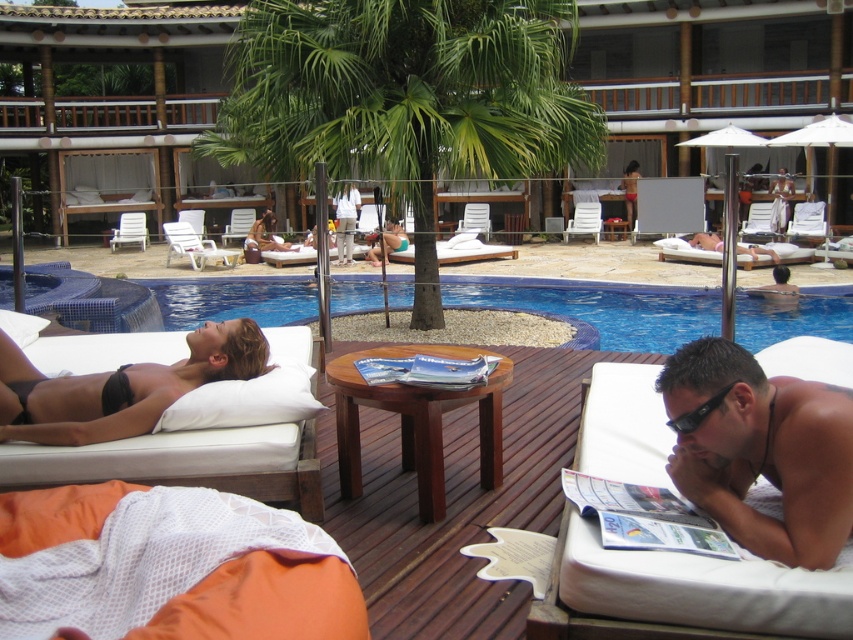
Based on the photo, does black bikini at upper left have a larger size compared to matte black bikini at center?

No, black bikini at upper left is not bigger than matte black bikini at center.

How far apart are black bikini at upper left and matte black bikini at center?

black bikini at upper left and matte black bikini at center are 14.84 meters apart from each other.

You are a GUI agent. You are given a task and a screenshot of the screen. Output one action in this format:
    pyautogui.click(x=<x>, y=<y>)
    Task: Click on the black bikini at upper left
    This screenshot has height=640, width=853.
    Given the screenshot: What is the action you would take?
    pyautogui.click(x=119, y=387)

Based on the photo, can you confirm if matte paper magazine at center is positioned below matte black bikini at center?

Yes.

Does point (453, 387) come in front of point (287, 244)?

Yes, point (453, 387) is in front of point (287, 244).

Who is more distant from viewer, (451, 376) or (252, 225)?

Positioned behind is point (252, 225).

Where is `matte paper magazine at center`? This screenshot has width=853, height=640. matte paper magazine at center is located at coordinates (427, 371).

Who is lower down, black bikini at upper left or white cotton shirt at center?

black bikini at upper left is lower down.

Where is `black bikini at upper left`? This screenshot has height=640, width=853. black bikini at upper left is located at coordinates (119, 387).